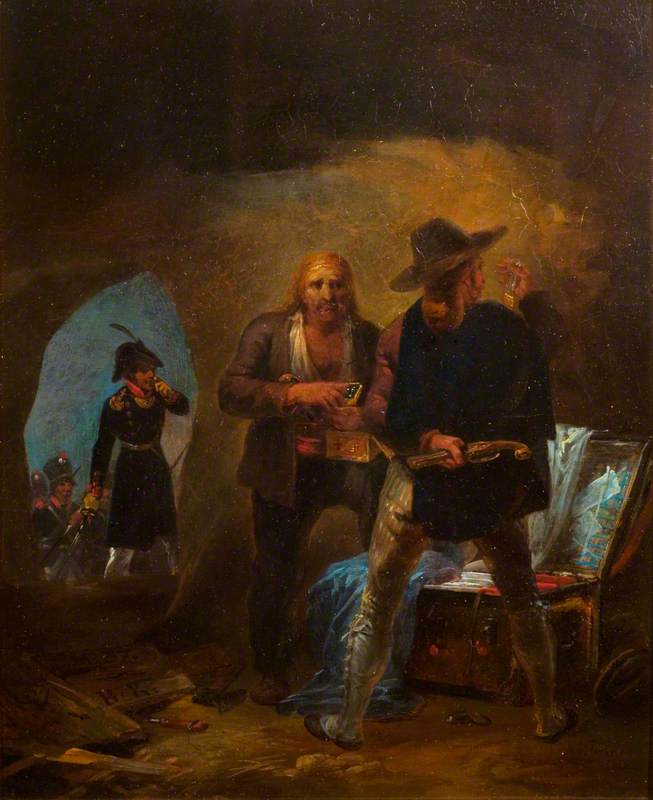
Find the location of a particular element. The height and width of the screenshot is (800, 653). painting is located at coordinates (334, 478).